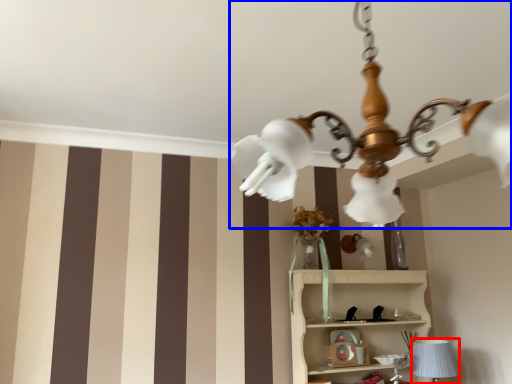
Question: Which object is closer to the camera taking this photo, table lamp (highlighted by a red box) or lamp (highlighted by a blue box)?

Choices:
 (A) table lamp
 (B) lamp

Answer: (B)